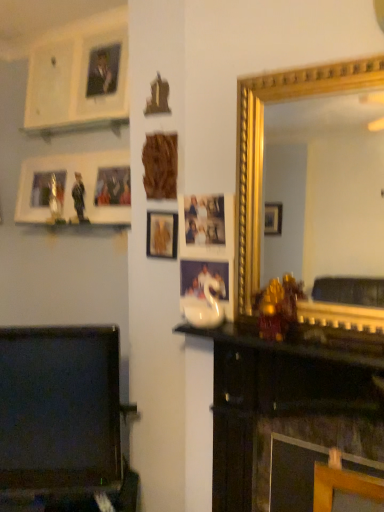
What do you see at coordinates (62, 422) in the screenshot?
I see `smooth black tv at lower left` at bounding box center [62, 422].

Measure the distance between point (212, 334) and camera.

A distance of 1.32 meters exists between point (212, 334) and camera.

The height and width of the screenshot is (512, 384). What do you see at coordinates (74, 188) in the screenshot?
I see `wooden picture frame at upper left, placed as the third picture frame when sorted from front to back` at bounding box center [74, 188].

Where is `wooden carving at center, marked as the third picture frame in a back-to-front arrangement`? wooden carving at center, marked as the third picture frame in a back-to-front arrangement is located at coordinates (160, 165).

Would you say smooth black tv at lower left is outside wooden carving at center, the 2th picture frame positioned from the right?

Absolutely, smooth black tv at lower left is external to wooden carving at center, the 2th picture frame positioned from the right.

Relative to wooden carving at center, placed as the 1th picture frame when sorted from front to back, is smooth black tv at lower left in front or behind?

smooth black tv at lower left is positioned closer to the viewer than wooden carving at center, placed as the 1th picture frame when sorted from front to back.

Considering the relative positions of smooth black tv at lower left and wooden carving at center, marked as the third picture frame in a back-to-front arrangement, in the image provided, is smooth black tv at lower left to the left of wooden carving at center, marked as the third picture frame in a back-to-front arrangement, from the viewer's perspective?

Indeed, smooth black tv at lower left is positioned on the left side of wooden carving at center, marked as the third picture frame in a back-to-front arrangement.

The image size is (384, 512). What are the coordinates of `furniture in front of the wooden carving at center, the 2th picture frame positioned from the right` in the screenshot? It's located at 62,422.

From a real-world perspective, is black glossy mantle at center physically located above or below wooden carving at center, placed as the 1th picture frame when sorted from front to back?

black glossy mantle at center is below wooden carving at center, placed as the 1th picture frame when sorted from front to back.

Looking at this image, which object is wider, black glossy mantle at center or wooden carving at center, placed as the 2th picture frame when sorted from left to right?

black glossy mantle at center is wider.

Does black glossy mantle at center appear on the left side of wooden carving at center, marked as the third picture frame in a back-to-front arrangement?

No.

Is wooden picture frame at center, which appears as the 2th picture frame when viewed from the back, in front of or behind smooth black tv at lower left in the image?

wooden picture frame at center, which appears as the 2th picture frame when viewed from the back, is behind smooth black tv at lower left.

Is wooden picture frame at center, which appears as the 2th picture frame when viewed from the back, oriented towards smooth black tv at lower left?

No, wooden picture frame at center, which appears as the 2th picture frame when viewed from the back, is not turned towards smooth black tv at lower left.

Is wooden picture frame at center, which appears as the 2th picture frame when viewed from the back, next to smooth black tv at lower left and touching it?

No.

Which of these two, wooden picture frame at center, which appears as the 2th picture frame when viewed from the back, or smooth black tv at lower left, is thinner?

Thinner between the two is wooden picture frame at center, which appears as the 2th picture frame when viewed from the back.

Consider the image. Which is more to the left, black glossy mantle at center or gold/gilded mirror at center-right?

From the viewer's perspective, black glossy mantle at center appears more on the left side.

Can gold/gilded mirror at center-right be found inside black glossy mantle at center?

No.

Is black glossy mantle at center positioned with its back to gold/gilded mirror at center-right?

No, black glossy mantle at center is not facing the opposite direction of gold/gilded mirror at center-right.

How different are the orientations of wooden picture frame at center, which is the 1th picture frame in right-to-left order, and black glossy mantle at center in degrees?

The angular difference between wooden picture frame at center, which is the 1th picture frame in right-to-left order, and black glossy mantle at center is 4.64 degrees.

Could you measure the distance between wooden picture frame at center, which is the 1th picture frame in right-to-left order, and black glossy mantle at center?

wooden picture frame at center, which is the 1th picture frame in right-to-left order, and black glossy mantle at center are 16.69 inches apart.

Can you confirm if wooden picture frame at center, which ranks as the second picture frame in front-to-back order, is positioned to the right of black glossy mantle at center?

No, wooden picture frame at center, which ranks as the second picture frame in front-to-back order, is not to the right of black glossy mantle at center.

Is point (158, 251) closer to camera compared to point (279, 343)?

No, it is behind (279, 343).

Is wooden carving at center, placed as the 1th picture frame when sorted from front to back, not inside smooth black tv at lower left?

wooden carving at center, placed as the 1th picture frame when sorted from front to back, lies outside smooth black tv at lower left's area.

Does wooden carving at center, placed as the 1th picture frame when sorted from front to back, touch smooth black tv at lower left?

There is a gap between wooden carving at center, placed as the 1th picture frame when sorted from front to back, and smooth black tv at lower left.

Does wooden carving at center, placed as the 1th picture frame when sorted from front to back, come in front of smooth black tv at lower left?

No, wooden carving at center, placed as the 1th picture frame when sorted from front to back, is behind smooth black tv at lower left.

From the image's perspective, is wooden carving at center, the 2th picture frame positioned from the right, under smooth black tv at lower left?

Incorrect, from the image's perspective, wooden carving at center, the 2th picture frame positioned from the right, is higher than smooth black tv at lower left.

Based on the photo, does smooth black tv at lower left appear on the right side of wooden picture frame at upper left, which is the 1th picture frame in left-to-right order?

Correct, you'll find smooth black tv at lower left to the right of wooden picture frame at upper left, which is the 1th picture frame in left-to-right order.

Is smooth black tv at lower left positioned with its back to wooden picture frame at upper left, the third picture frame positioned from the right?

smooth black tv at lower left is not turned away from wooden picture frame at upper left, the third picture frame positioned from the right.

From the image's perspective, is smooth black tv at lower left positioned above or below wooden picture frame at upper left, which is the 1th picture frame in left-to-right order?

smooth black tv at lower left is below wooden picture frame at upper left, which is the 1th picture frame in left-to-right order.

Consider the image. Is smooth black tv at lower left situated inside wooden picture frame at upper left, placed as the third picture frame when sorted from front to back, or outside?

smooth black tv at lower left lies outside wooden picture frame at upper left, placed as the third picture frame when sorted from front to back.

Find the location of a particular element. The width and height of the screenshot is (384, 512). furniture below the wooden carving at center, placed as the 1th picture frame when sorted from front to back (from the image's perspective) is located at coordinates (62, 422).

From the black glossy mantle at center, count the 2nd picture frame to the left and point to it. Please provide its 2D coordinates.

[(160, 165)]

Looking at the image, which one is located further to smooth black tv at lower left, wooden carving at center, the 2th picture frame positioned from the right, or wooden picture frame at upper left, placed as the third picture frame when sorted from front to back?

Based on the image, wooden picture frame at upper left, placed as the third picture frame when sorted from front to back, appears to be further to smooth black tv at lower left.

Based on their spatial positions, is black glossy mantle at center or wooden carving at center, placed as the 1th picture frame when sorted from front to back, closer to gold/gilded mirror at center-right?

The object closer to gold/gilded mirror at center-right is wooden carving at center, placed as the 1th picture frame when sorted from front to back.

Estimate the real-world distances between objects in this image. Which object is closer to gold/gilded mirror at center-right, smooth black tv at lower left or wooden picture frame at upper left, placed as the third picture frame when sorted from front to back?

wooden picture frame at upper left, placed as the third picture frame when sorted from front to back, is positioned closer to the anchor gold/gilded mirror at center-right.

Which object lies nearer to the anchor point wooden carving at center, the 2th picture frame positioned from the right, black glossy mantle at center or gold/gilded mirror at center-right?

black glossy mantle at center is closer to wooden carving at center, the 2th picture frame positioned from the right.

When comparing their distances from wooden carving at center, placed as the 1th picture frame when sorted from front to back, does wooden picture frame at center, which ranks as the second picture frame in front-to-back order, or black glossy mantle at center seem closer?

wooden picture frame at center, which ranks as the second picture frame in front-to-back order.

Which object lies further to the anchor point smooth black tv at lower left, wooden picture frame at center, which appears as the 2th picture frame when viewed from the back, or wooden picture frame at upper left, which is the 1th picture frame in left-to-right order?

Based on the image, wooden picture frame at upper left, which is the 1th picture frame in left-to-right order, appears to be further to smooth black tv at lower left.

From the image, which object appears to be nearer to smooth black tv at lower left, black glossy mantle at center or wooden carving at center, placed as the 1th picture frame when sorted from front to back?

black glossy mantle at center.

Considering their positions, is gold/gilded mirror at center-right positioned further to wooden carving at center, the 2th picture frame positioned from the right, than wooden picture frame at center, positioned as the third picture frame in left-to-right order?

The object further to wooden carving at center, the 2th picture frame positioned from the right, is gold/gilded mirror at center-right.

What are the coordinates of `mantle located between smooth black tv at lower left and gold/gilded mirror at center-right in the left-right direction` in the screenshot? It's located at (280, 345).

Identify the location of mirror between wooden carving at center, marked as the third picture frame in a back-to-front arrangement, and smooth black tv at lower left from top to bottom. The width and height of the screenshot is (384, 512). (324, 188).

At what (x,y) coordinates should I click in order to perform the action: click on picture frame located between wooden carving at center, placed as the 1th picture frame when sorted from front to back, and gold/gilded mirror at center-right in the left-right direction. Please return your answer as a coordinate pair (x, y). Looking at the image, I should click on (162, 234).

Find the location of a particular element. mirror located between black glossy mantle at center and wooden picture frame at center, which is the 1th picture frame in right-to-left order, in the depth direction is located at coordinates (324, 188).